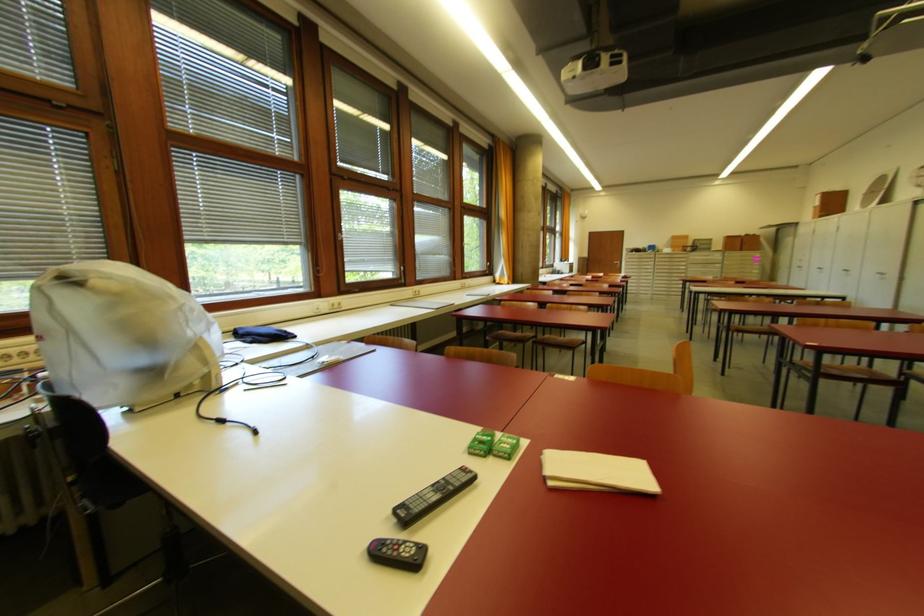
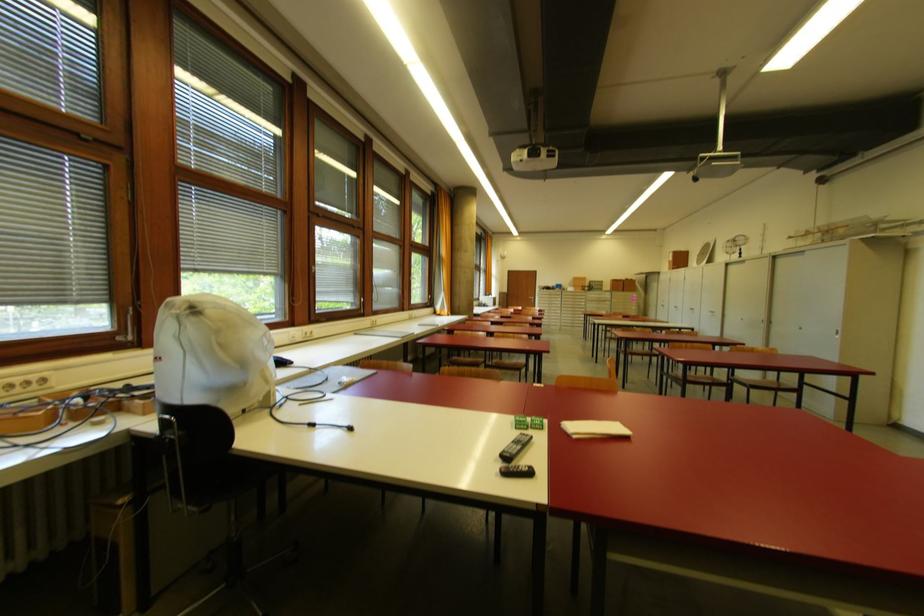
Where in the second image is the point corresponding to (x=842, y=191) from the first image?

(686, 251)